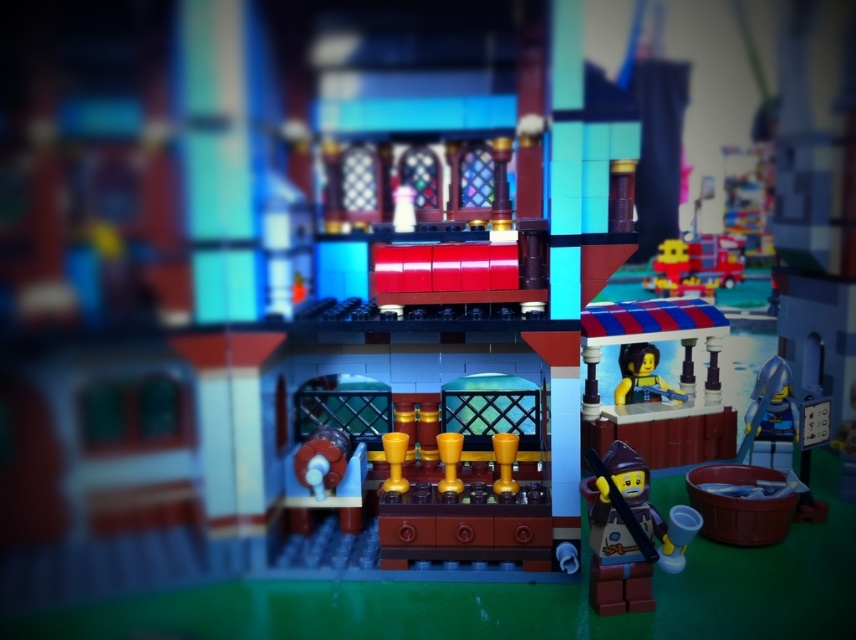
Can you confirm if striped fabric stand at right is positioned below brown matte minifigure at lower right?

No.

Is point (646, 339) farther from camera compared to point (638, 509)?

Yes.

Between point (675, 307) and point (603, 561), which one is positioned in front?

Point (603, 561) is in front.

You are a GUI agent. You are given a task and a screenshot of the screen. Output one action in this format:
    pyautogui.click(x=<x>, y=<y>)
    Task: Click on the striped fabric stand at right
    
    Given the screenshot: What is the action you would take?
    pyautogui.click(x=658, y=385)

Which is below, striped fabric stand at right or smooth plastic figure at center?

smooth plastic figure at center

Consider the image. Is striped fabric stand at right below smooth plastic figure at center?

No.

Between point (735, 433) and point (651, 384), which one is positioned in front?

Point (735, 433)

Locate an element on the screen. striped fabric stand at right is located at coordinates (658, 385).

Is brown matte minifigure at lower right behind smooth plastic figure at center?

No, it is not.

Find the location of a particular element. This screenshot has width=856, height=640. brown matte minifigure at lower right is located at coordinates (622, 531).

This screenshot has width=856, height=640. In order to click on brown matte minifigure at lower right in this screenshot , I will do `click(622, 531)`.